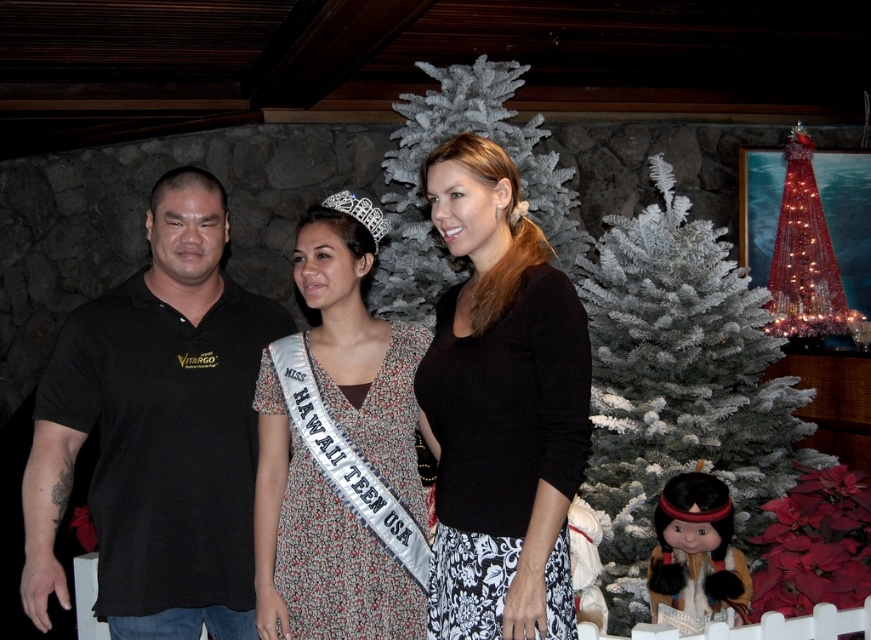
Question: Is shiny red beaded christmas tree at upper right smaller than silver metallic tiara at center?

Choices:
 (A) yes
 (B) no

Answer: (B)

Question: Which object is positioned farthest from the matte black doll at lower right?

Choices:
 (A) silver metallic tiara at center
 (B) white frosted christmas tree at right

Answer: (A)

Question: In this image, where is floral-patterned fabric dress at center located relative to silver metallic tiara at center?

Choices:
 (A) right
 (B) left

Answer: (B)

Question: Which of these objects is positioned closest to the matte black doll at lower right?

Choices:
 (A) shiny red beaded christmas tree at upper right
 (B) black cotton polo shirt at left
 (C) black ribbed sweater at center

Answer: (C)

Question: Among these objects, which one is nearest to the camera?

Choices:
 (A) floral-patterned fabric dress at center
 (B) silver metallic tiara at center
 (C) matte black doll at lower right
 (D) white frosted christmas tree at right

Answer: (A)

Question: Is white frosted christmas tree at right thinner than floral-patterned fabric dress at center?

Choices:
 (A) no
 (B) yes

Answer: (A)